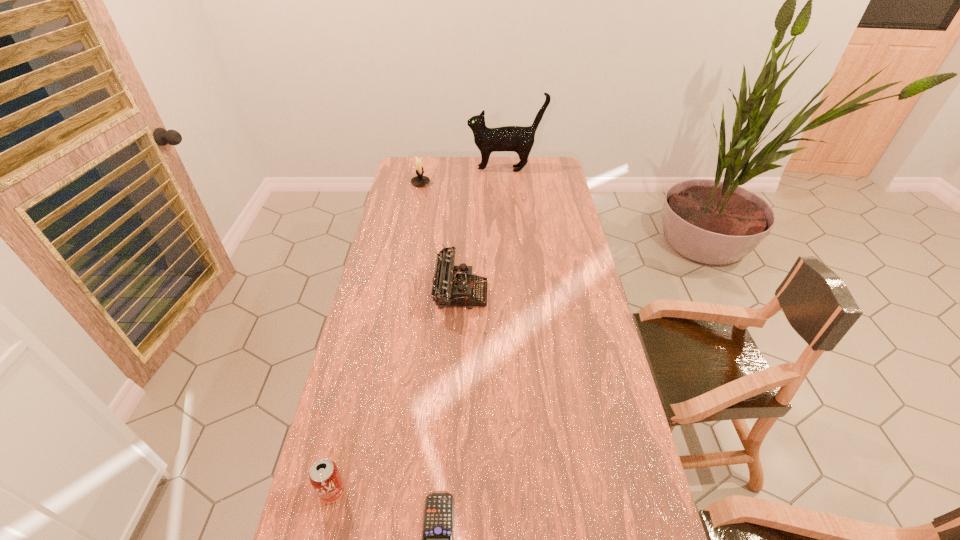
Identify the location of the farthest object. This screenshot has height=540, width=960. (518, 139).

At what (x,y) coordinates should I click in order to perform the action: click on the tallest object. Please return your answer as a coordinate pair (x, y). Looking at the image, I should click on (518, 139).

In order to click on the fourth nearest object in this screenshot , I will do `click(419, 180)`.

Locate an element on the screen. The height and width of the screenshot is (540, 960). candle holder is located at coordinates (419, 180).

This screenshot has width=960, height=540. I want to click on the third farthest object, so click(452, 285).

At what (x,y) coordinates should I click in order to perform the action: click on soda can. Please return your answer as a coordinate pair (x, y). Looking at the image, I should click on (324, 476).

The width and height of the screenshot is (960, 540). What are the coordinates of `free spot located 0.220m on the face of the tallest object` in the screenshot? It's located at (424, 169).

The image size is (960, 540). I want to click on vacant space located on the face of the tallest object, so click(x=458, y=169).

This screenshot has height=540, width=960. In order to click on vacant space positioned on the face of the tallest object in this screenshot , I will do (426, 169).

Find the location of a particular element. The image size is (960, 540). vacant point located on the front of the fourth shortest object is located at coordinates (414, 218).